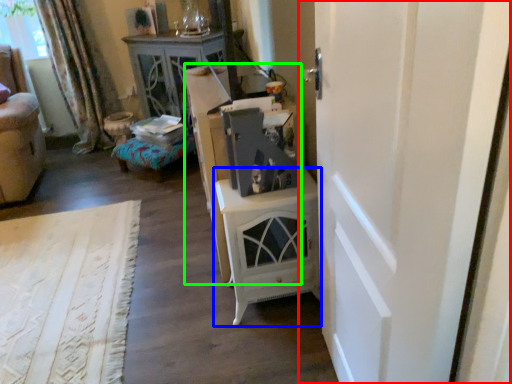
Question: Considering the real-world distances, which object is closest to door (highlighted by a red box)? nightstand (highlighted by a blue box) or dresser (highlighted by a green box).

Choices:
 (A) nightstand
 (B) dresser

Answer: (A)